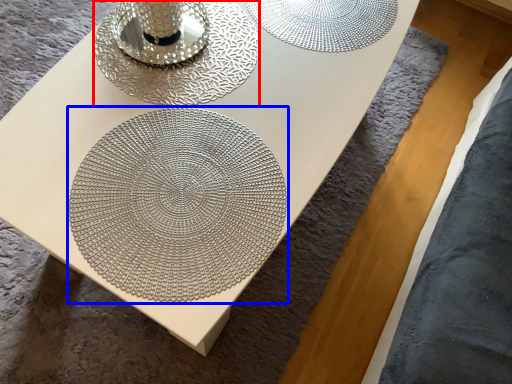
Question: Among these objects, which one is nearest to the camera, candle holder (highlighted by a red box) or mandala (highlighted by a blue box)?

Choices:
 (A) candle holder
 (B) mandala

Answer: (B)